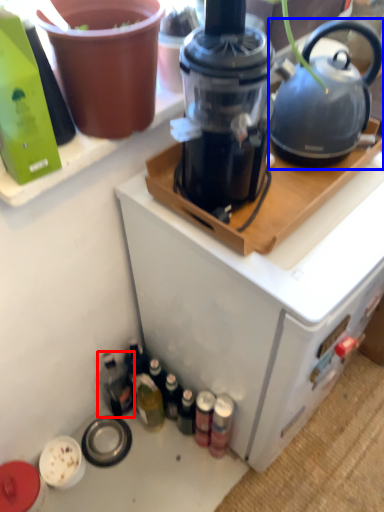
Question: Which object appears closest to the camera in this image, bottle (highlighted by a red box) or kettle (highlighted by a blue box)?

Choices:
 (A) bottle
 (B) kettle

Answer: (B)